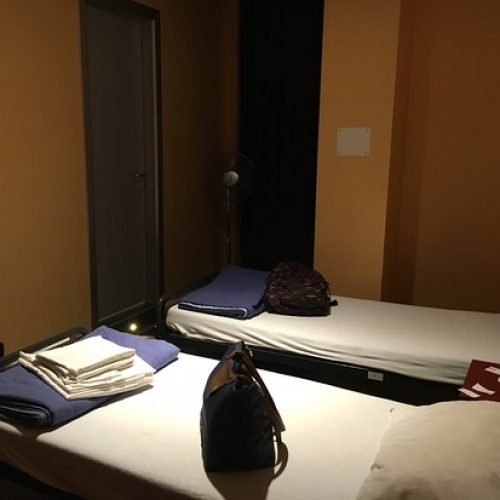
In order to click on door in this screenshot , I will do 114,136.